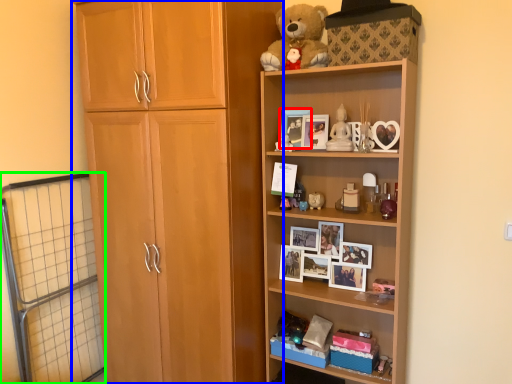
Question: Considering the real-world distances, which object is farthest from picture frame (highlighted by a red box)? cupboard (highlighted by a blue box) or screen door (highlighted by a green box)?

Choices:
 (A) cupboard
 (B) screen door

Answer: (B)